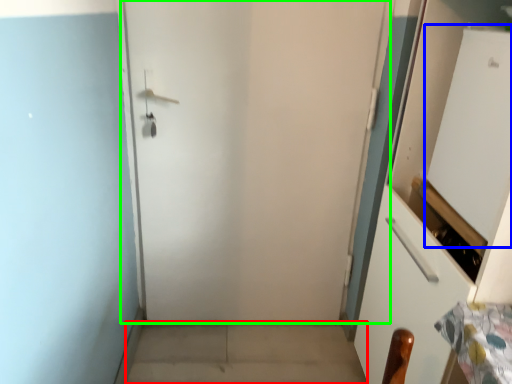
Question: Based on their relative distances, which object is nearer to concrete (highlighted by a red box)? Choose from screen door (highlighted by a blue box) and door (highlighted by a green box).

Choices:
 (A) screen door
 (B) door

Answer: (B)